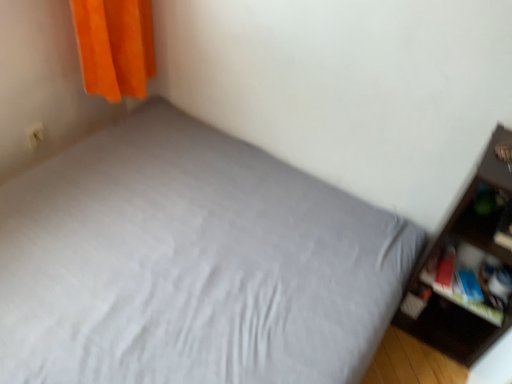
Where is `matte plastic cabinet at right`? This screenshot has height=384, width=512. matte plastic cabinet at right is located at coordinates (465, 283).

You are a GUI agent. You are given a task and a screenshot of the screen. Output one action in this format:
    pyautogui.click(x=<x>, y=<y>)
    Task: Click on the gray fabric bed at center
    The image size is (512, 384).
    Given the screenshot: What is the action you would take?
    pyautogui.click(x=191, y=264)

This screenshot has height=384, width=512. I want to click on matte dark brown shelf at right, so click(439, 263).

Is gray fabric bed at center not near matte dark brown shelf at right?

No.

Does gray fabric bed at center contain matte dark brown shelf at right?

No, matte dark brown shelf at right is not inside gray fabric bed at center.

From the picture: From a real-world perspective, is gray fabric bed at center physically above matte dark brown shelf at right?

No, from a real-world perspective, gray fabric bed at center is not over matte dark brown shelf at right

How many degrees apart are the facing directions of matte plastic cabinet at right and matte dark brown shelf at right?

The angle between the facing direction of matte plastic cabinet at right and the facing direction of matte dark brown shelf at right is 2.37 degrees.

Is matte plastic cabinet at right placed right next to matte dark brown shelf at right?

There is a gap between matte plastic cabinet at right and matte dark brown shelf at right.

From the image's perspective, which is above, matte plastic cabinet at right or matte dark brown shelf at right?

matte dark brown shelf at right is shown above in the image.

Is matte plastic cabinet at right facing towards matte dark brown shelf at right?

Yes, matte plastic cabinet at right is oriented towards matte dark brown shelf at right.

Is matte plastic cabinet at right wider than gray fabric bed at center?

No.

In the image, there is a gray fabric bed at center. Find the location of `cabinet below it (from the image's perspective)`. cabinet below it (from the image's perspective) is located at coordinates (465, 283).

Is matte plastic cabinet at right at the right side of gray fabric bed at center?

Yes, matte plastic cabinet at right is to the right of gray fabric bed at center.

Which is farther from the camera, (121, 365) or (483, 257)?

The point (483, 257) is farther from the camera.

From the image's perspective, is gray fabric bed at center on top of matte plastic cabinet at right?

Yes, from the image's perspective, gray fabric bed at center is on top of matte plastic cabinet at right.

Would you say gray fabric bed at center is a long distance from matte plastic cabinet at right?

No, gray fabric bed at center is not far away from matte plastic cabinet at right.

The image size is (512, 384). I want to click on cabinet behind the gray fabric bed at center, so click(x=465, y=283).

Is matte dark brown shelf at right thinner than matte plastic cabinet at right?

Incorrect, the width of matte dark brown shelf at right is not less than that of matte plastic cabinet at right.

Which is farther from the camera, (448, 315) or (482, 314)?

The point (448, 315) is farther from the camera.

Would you say matte dark brown shelf at right contains matte plastic cabinet at right?

Yes, matte dark brown shelf at right contains matte plastic cabinet at right.

Considering the relative sizes of matte dark brown shelf at right and gray fabric bed at center in the image provided, is matte dark brown shelf at right thinner than gray fabric bed at center?

Yes, matte dark brown shelf at right is thinner than gray fabric bed at center.

From a real-world perspective, is matte dark brown shelf at right positioned above or below gray fabric bed at center?

matte dark brown shelf at right is situated higher than gray fabric bed at center in the real world.

Considering the sizes of matte dark brown shelf at right and gray fabric bed at center in the image, is matte dark brown shelf at right taller or shorter than gray fabric bed at center?

Clearly, matte dark brown shelf at right is taller compared to gray fabric bed at center.

Find the location of `bed lying below the matte dark brown shelf at right (from the image's perspective)`. bed lying below the matte dark brown shelf at right (from the image's perspective) is located at coordinates (191, 264).

I want to click on bed that appears in front of the matte dark brown shelf at right, so (191, 264).

Identify the location of cabinet behind the matte dark brown shelf at right. (465, 283).

Looking at this image, which object lies nearer to the anchor point matte dark brown shelf at right, matte plastic cabinet at right or gray fabric bed at center?

matte plastic cabinet at right.

Considering their positions, is matte plastic cabinet at right positioned closer to gray fabric bed at center than matte dark brown shelf at right?

matte plastic cabinet at right is positioned closer to the anchor gray fabric bed at center.

Estimate the real-world distances between objects in this image. Which object is further from matte plastic cabinet at right, matte dark brown shelf at right or gray fabric bed at center?

gray fabric bed at center.

When comparing their distances from matte plastic cabinet at right, does gray fabric bed at center or matte dark brown shelf at right seem closer?

matte dark brown shelf at right is closer to matte plastic cabinet at right.

From the image, which object appears to be farther from matte dark brown shelf at right, gray fabric bed at center or matte plastic cabinet at right?

gray fabric bed at center lies further to matte dark brown shelf at right than the other object.

When comparing their distances from gray fabric bed at center, does matte dark brown shelf at right or matte plastic cabinet at right seem closer?

The object closer to gray fabric bed at center is matte plastic cabinet at right.

Find the location of a particular element. The width and height of the screenshot is (512, 384). cabinet located between gray fabric bed at center and matte dark brown shelf at right in the left-right direction is located at coordinates (465, 283).